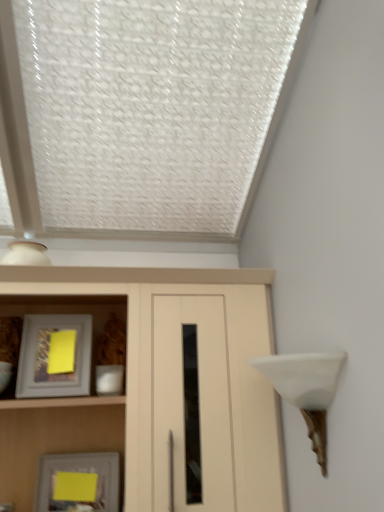
Question: From their relative heights in the image, would you say white matte table lamp at right is taller or shorter than matte wood cupboard at center?

Choices:
 (A) tall
 (B) short

Answer: (B)

Question: From the image's perspective, is white matte table lamp at right positioned above or below matte wood cupboard at center?

Choices:
 (A) below
 (B) above

Answer: (B)

Question: Considering the real-world distances, which object is closest to the yellow paper at lower left, positioned as the 2th picture frame in top-to-bottom order?

Choices:
 (A) white matte table lamp at right
 (B) matte gray picture frame at left, the first picture frame viewed from the top
 (C) matte wood cupboard at center

Answer: (B)

Question: Estimate the real-world distances between objects in this image. Which object is closer to the white matte table lamp at right?

Choices:
 (A) matte wood cupboard at center
 (B) matte gray picture frame at left, the 2th picture frame in the bottom-to-top sequence
 (C) yellow paper at lower left, acting as the first picture frame starting from the bottom

Answer: (A)